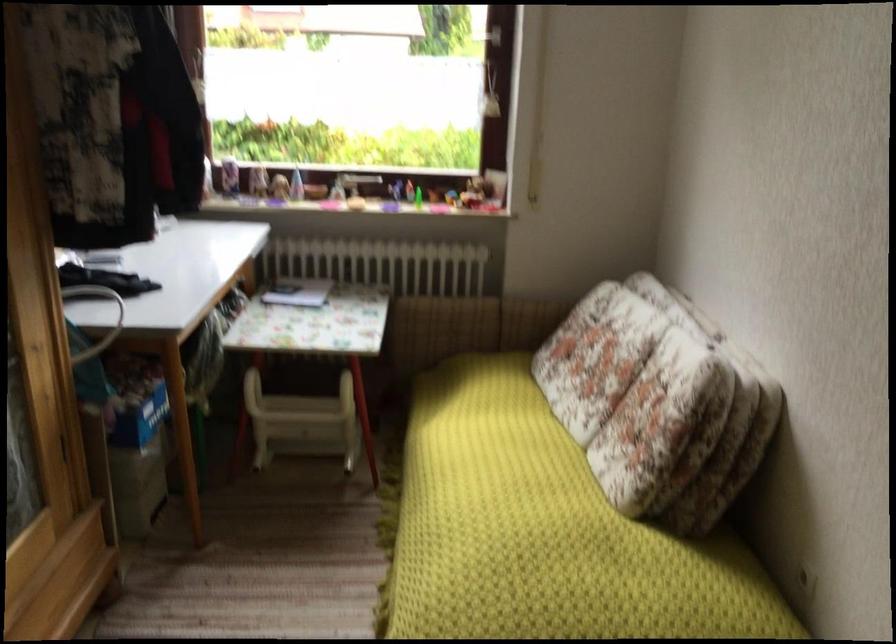
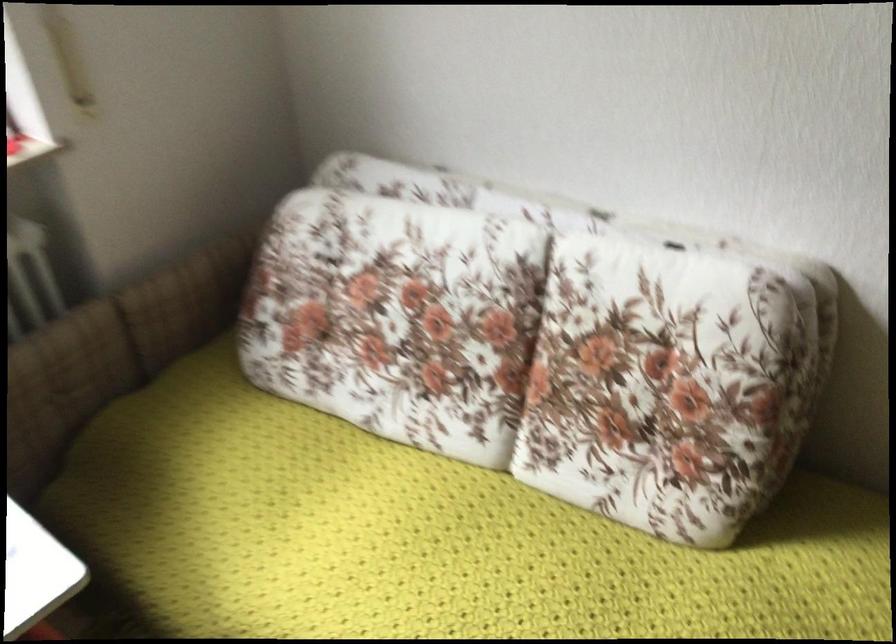
In the second image, find the point that corresponds to the point at 509,436 in the first image.

(429, 538)